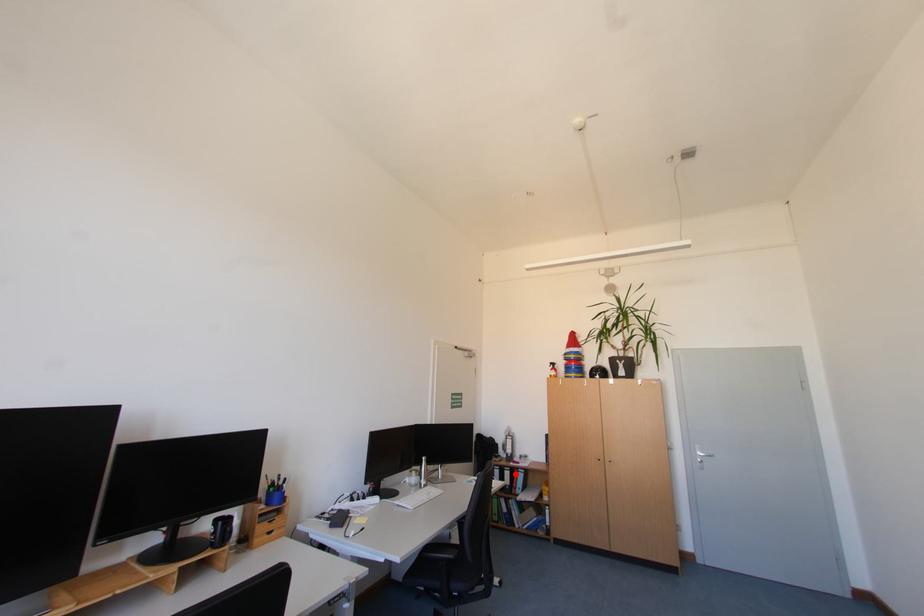
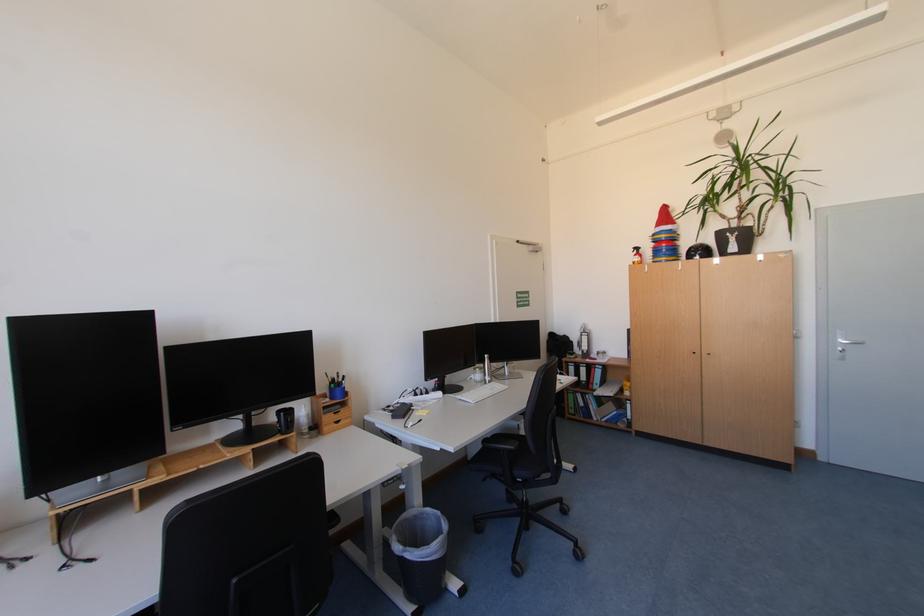
The point at the highlighted location is marked in the first image. Where is the corresponding point in the second image?

(590, 371)